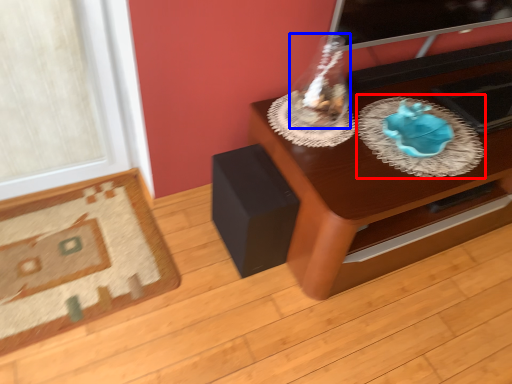
Question: Which object is closer to the camera taking this photo, glass plate (highlighted by a red box) or glass vase (highlighted by a blue box)?

Choices:
 (A) glass plate
 (B) glass vase

Answer: (B)